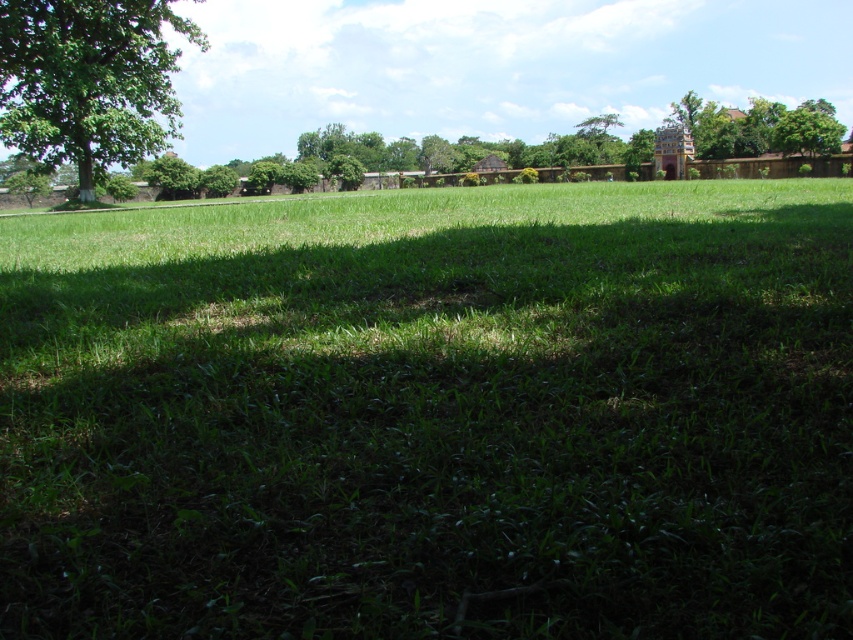
Question: Which object appears closest to the camera in this image?

Choices:
 (A) green grassy field at center
 (B) green leafy tree at upper left

Answer: (A)

Question: Can you confirm if green grassy field at center is thinner than green leafy tree at upper left?

Choices:
 (A) yes
 (B) no

Answer: (B)

Question: Which of the following is the farthest from the observer?

Choices:
 (A) green leafy tree at upper left
 (B) green grassy field at center

Answer: (A)

Question: Which point is closer to the camera taking this photo?

Choices:
 (A) (465, 397)
 (B) (132, 88)

Answer: (A)

Question: Can you confirm if green grassy field at center is smaller than green leafy tree at upper left?

Choices:
 (A) yes
 (B) no

Answer: (B)

Question: Is green grassy field at center below green leafy tree at upper left?

Choices:
 (A) yes
 (B) no

Answer: (A)